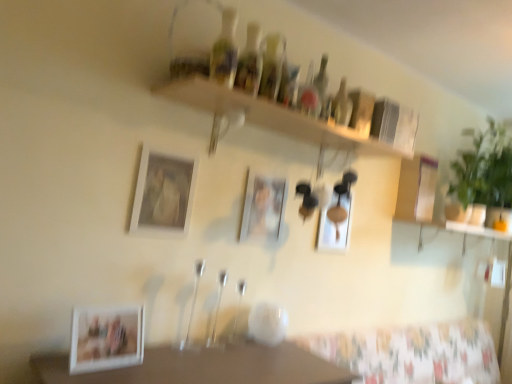
Question: Which direction should I rotate to look at translucent glass bottles at upper center, which is the 3th bottle from right to left?

Choices:
 (A) right
 (B) left

Answer: (A)

Question: Is translucent glass bottles at upper center, which is the 3th bottle from right to left, not close to translucent glass bottles at upper center, marked as the fourth bottle in a right-to-left arrangement?

Choices:
 (A) yes
 (B) no

Answer: (B)

Question: Considering the relative sizes of translucent glass bottles at upper center, which is the 3th bottle from right to left, and translucent glass bottles at upper center, placed as the 2th bottle when sorted from front to back, in the image provided, is translucent glass bottles at upper center, which is the 3th bottle from right to left, wider than translucent glass bottles at upper center, placed as the 2th bottle when sorted from front to back,?

Choices:
 (A) yes
 (B) no

Answer: (A)

Question: Is translucent glass bottles at upper center, which is the third bottle from left to right, in front of translucent glass bottles at upper center, placed as the 2th bottle when sorted from front to back?

Choices:
 (A) yes
 (B) no

Answer: (B)

Question: From a real-world perspective, is translucent glass bottles at upper center, which is the 3th bottle from right to left, under translucent glass bottles at upper center, acting as the fourth bottle starting from the back?

Choices:
 (A) yes
 (B) no

Answer: (A)

Question: Does translucent glass bottles at upper center, which is the third bottle from front to back, have a lesser height compared to translucent glass bottles at upper center, placed as the 2th bottle when sorted from front to back?

Choices:
 (A) no
 (B) yes

Answer: (A)

Question: Considering the relative positions of translucent glass bottles at upper center, which is the third bottle from front to back, and translucent glass bottles at upper center, marked as the second bottle in a left-to-right arrangement, in the image provided, is translucent glass bottles at upper center, which is the third bottle from front to back, to the right of translucent glass bottles at upper center, marked as the second bottle in a left-to-right arrangement, from the viewer's perspective?

Choices:
 (A) no
 (B) yes

Answer: (B)

Question: Are translucent glass bottles at upper center, the 1th bottle in the left-to-right sequence, and translucent glass bottles at upper center, which is the third bottle from back to front, beside each other?

Choices:
 (A) yes
 (B) no

Answer: (B)

Question: Considering the relative sizes of translucent glass bottles at upper center, arranged as the 1th bottle when viewed from the front, and translucent glass bottles at upper center, which is the third bottle from back to front, in the image provided, is translucent glass bottles at upper center, arranged as the 1th bottle when viewed from the front, shorter than translucent glass bottles at upper center, which is the third bottle from back to front,?

Choices:
 (A) no
 (B) yes

Answer: (B)

Question: Is translucent glass bottles at upper center, which is the fifth bottle in right-to-left order, not close to translucent glass bottles at upper center, which is the third bottle from left to right?

Choices:
 (A) yes
 (B) no

Answer: (B)

Question: Is translucent glass bottles at upper center, which is the third bottle from left to right, at the back of translucent glass bottles at upper center, which is the fifth bottle in right-to-left order?

Choices:
 (A) yes
 (B) no

Answer: (B)

Question: Considering the relative positions of translucent glass bottles at upper center, which is the fifth bottle in right-to-left order, and translucent glass bottles at upper center, which is the third bottle from left to right, in the image provided, is translucent glass bottles at upper center, which is the fifth bottle in right-to-left order, to the right of translucent glass bottles at upper center, which is the third bottle from left to right, from the viewer's perspective?

Choices:
 (A) no
 (B) yes

Answer: (A)

Question: Does translucent glass bottles at upper center, the 1th bottle in the left-to-right sequence, lie behind translucent glass bottles at upper center, which is the third bottle from left to right?

Choices:
 (A) no
 (B) yes

Answer: (A)

Question: Does matte white picture frame at upper center, marked as the third picture frame in a right-to-left arrangement, have a lesser height compared to matte white picture frame at center, the first picture frame from the right?

Choices:
 (A) yes
 (B) no

Answer: (B)